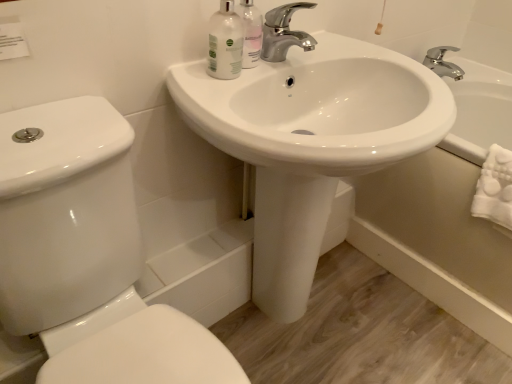
Image resolution: width=512 pixels, height=384 pixels. What are the coordinates of `vacant space to the right of chrome metallic faucet at upper center` in the screenshot? It's located at (340, 49).